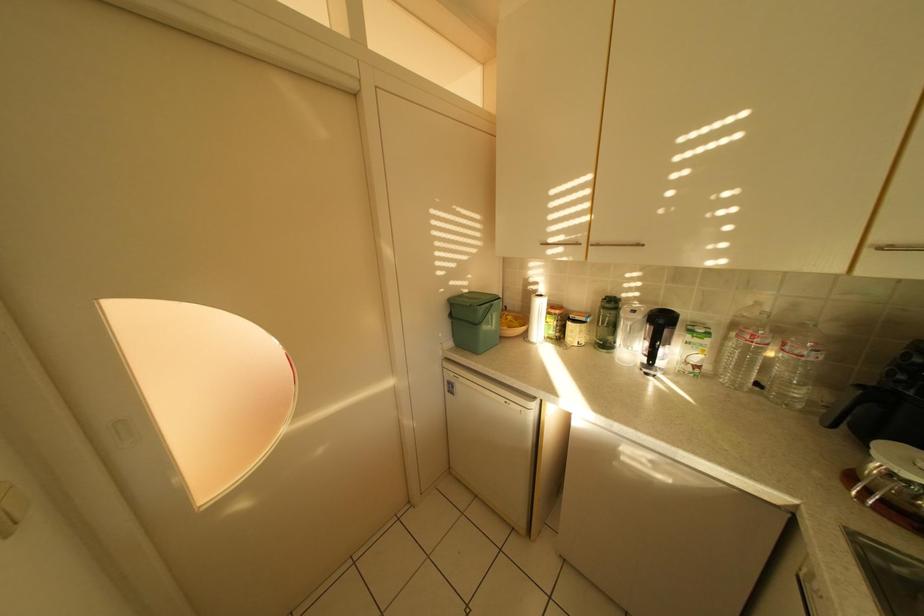
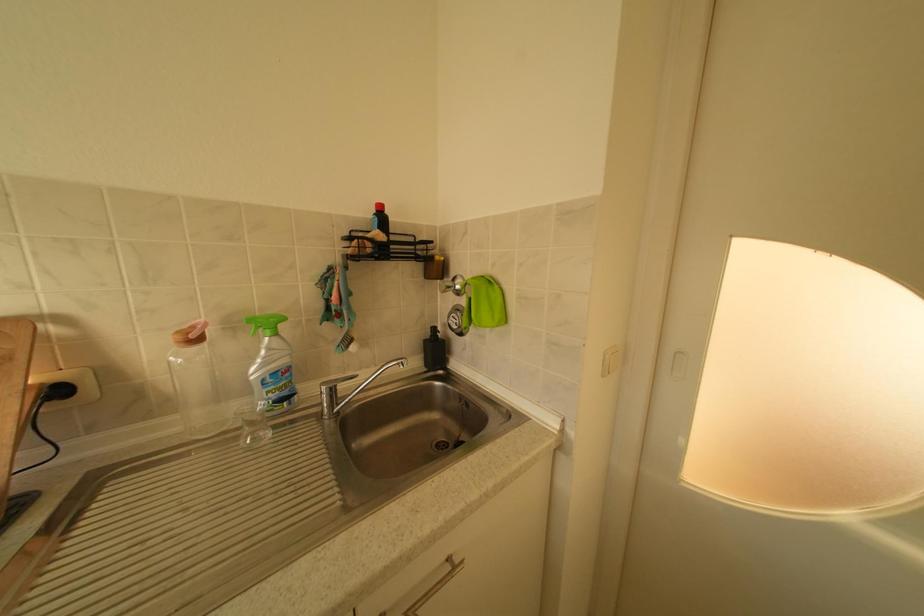
Question: The images are taken continuously from a first-person perspective. In which direction is your viewpoint rotating?

Choices:
 (A) Left
 (B) Right
 (C) Up
 (D) Down

Answer: (A)